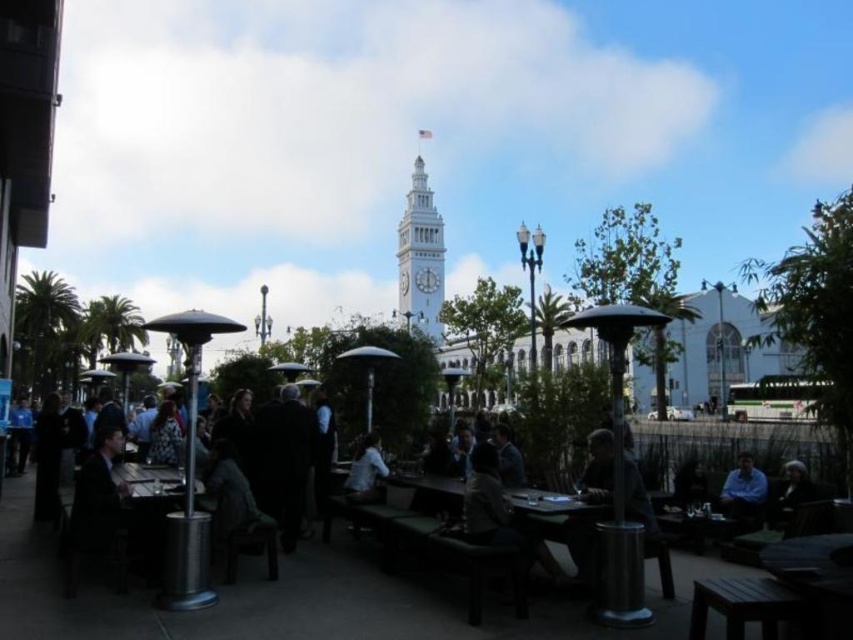
Based on the photo, you are standing in the plaza and want to take a photo of the blue shirt at lower right without including the white painted metal clock tower at center in the background. Which direction should you move to achieve this?

Move to the right side of the blue shirt at lower right so that the white painted metal clock tower at center is no longer in the background.

You are a tourist standing at the base of the white painted metal clock tower at center and want to reach the dark brown leather jacket at lower right. Given that the average walking speed is 1.4 meters per second, how many seconds will it take to reach the jacket?

The distance between the white painted metal clock tower at center and the dark brown leather jacket at lower right is 75.28 meters. At an average walking speed of 1.4 meters per second, it would take approximately 53.77 seconds to reach the jacket.